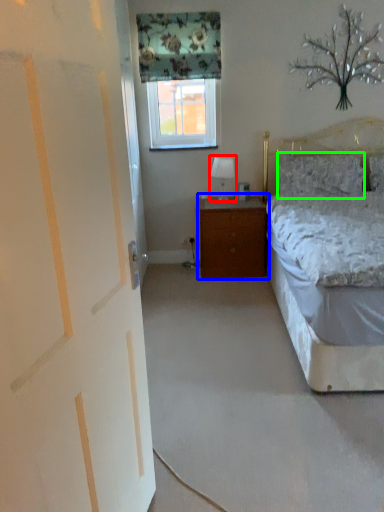
Question: Which object is the farthest from table lamp (highlighted by a red box)? Choose among these: nightstand (highlighted by a blue box) or pillow (highlighted by a green box).

Choices:
 (A) nightstand
 (B) pillow

Answer: (B)